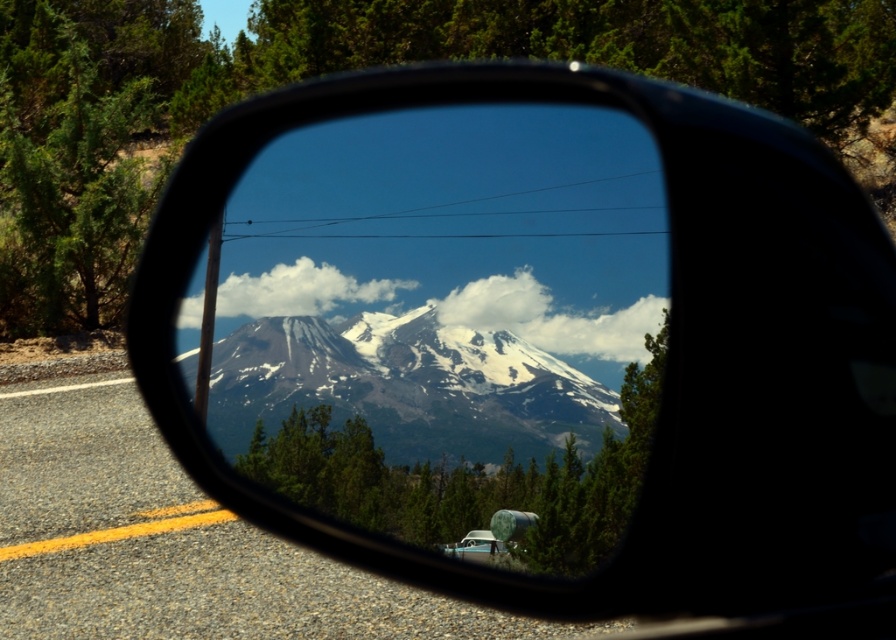
You are driving a car and looking at the side mirror. The mirror shows a point at coordinates (408, 384). What does this point represent?

The point at coordinates (408, 384) represents the snowy granite mountain at center.

You are driving a car and want to know if the snowy granite mountain at center in the side mirror is closer or farther than the white matte van at center. Based on the reflection in the side mirror, which one is farther away?

The snowy granite mountain at center is farther away from the white matte van at center by 12.82 inches, so the snowy granite mountain at center is farther away.

You are driving a car and looking at the side mirror. You see the snowy granite mountain at center and the white matte van at center. Which object appears wider in the side mirror?

The snowy granite mountain at center appears wider than the white matte van at center in the side mirror because its width surpasses the van.